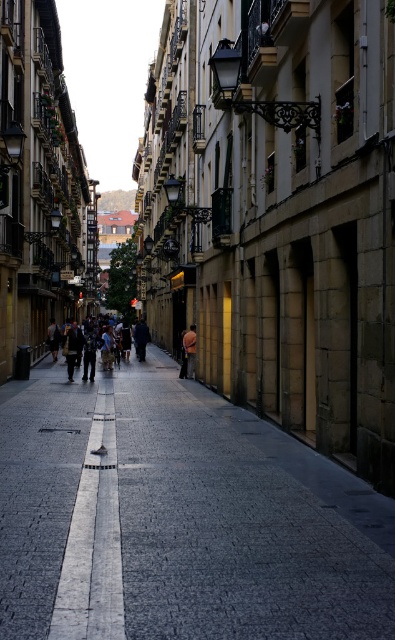
In the scene shown: Does dark gray cobblestone at center appear over orange fabric bag at center?

No.

Does point (252, 570) come farther from viewer compared to point (193, 356)?

No, (252, 570) is in front of (193, 356).

Find the location of a particular element. The width and height of the screenshot is (395, 640). dark gray cobblestone at center is located at coordinates (178, 518).

Which is behind, point (97, 339) or point (188, 364)?

Point (97, 339)

The image size is (395, 640). In order to click on dark blue jeans at center in this screenshot , I will do `click(80, 346)`.

Locate an element on the screen. This screenshot has width=395, height=640. dark blue jeans at center is located at coordinates (80, 346).

From the picture: Which of these two, dark gray cobblestone at center or dark blue jeans at center, stands shorter?

dark gray cobblestone at center is shorter.

Does dark gray cobblestone at center have a greater width compared to dark blue jeans at center?

Yes, dark gray cobblestone at center is wider than dark blue jeans at center.

Where is `dark gray cobblestone at center`? This screenshot has width=395, height=640. dark gray cobblestone at center is located at coordinates (178, 518).

This screenshot has height=640, width=395. I want to click on dark gray cobblestone at center, so click(178, 518).